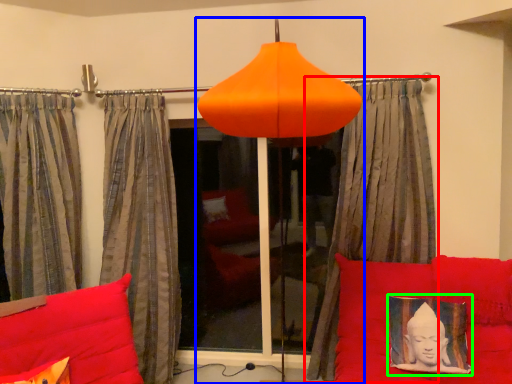
Question: Estimate the real-world distances between objects in this image. Which object is farther from curtain (highlighted by a red box), lamp (highlighted by a blue box) or picture frame (highlighted by a green box)?

Choices:
 (A) lamp
 (B) picture frame

Answer: (A)